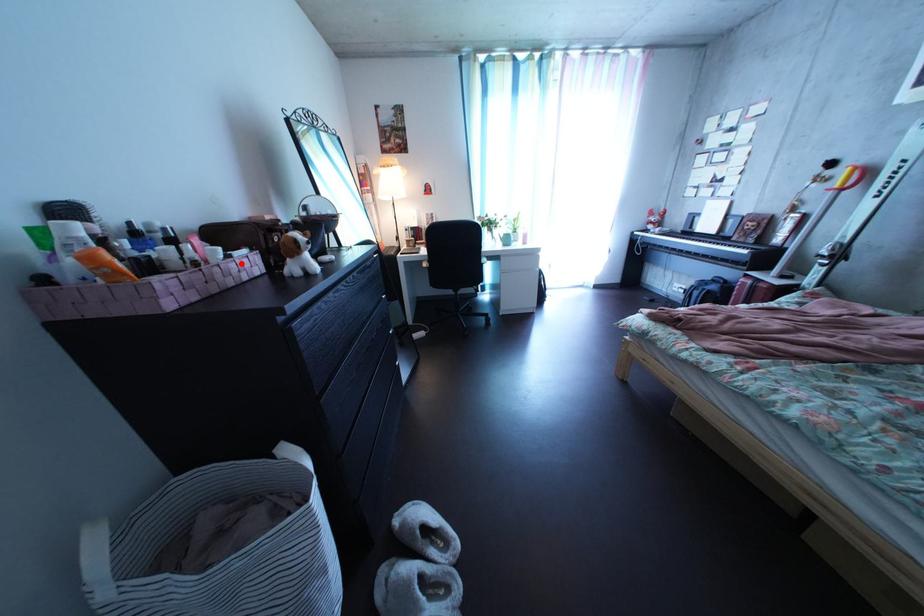
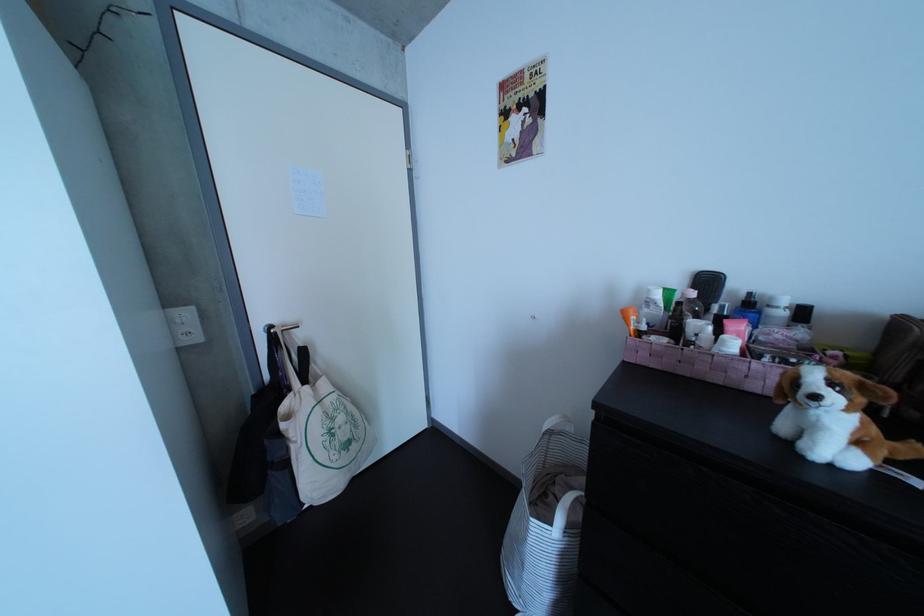
Where in the second image is the point corresponding to the highlighted location from the first image?

(764, 362)